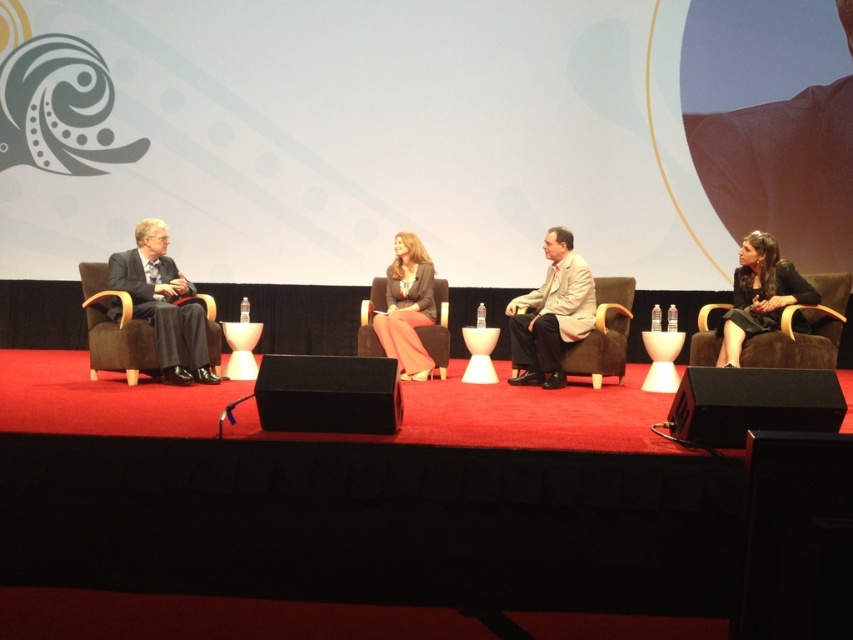
Question: Which of the following is the farthest from the observer?

Choices:
 (A) black fabric dress at right
 (B) light brown fabric armchair at center
 (C) brown fabric armchair at left
 (D) suede-like brown armchair at center

Answer: (D)

Question: Which point is closer to the camera?

Choices:
 (A) suede-like brown armchair at center
 (B) black fabric dress at right

Answer: (B)

Question: Can you confirm if black fabric dress at right is wider than brown fabric armchair at left?

Choices:
 (A) yes
 (B) no

Answer: (B)

Question: Does brown fabric armchair at left have a greater width compared to light brown fabric armchair at center?

Choices:
 (A) no
 (B) yes

Answer: (B)

Question: Among these points, which one is nearest to the camera?

Choices:
 (A) (608, 280)
 (B) (374, 307)

Answer: (A)

Question: Does brown fabric armchair at left have a smaller size compared to suede-like brown armchair at center?

Choices:
 (A) no
 (B) yes

Answer: (A)